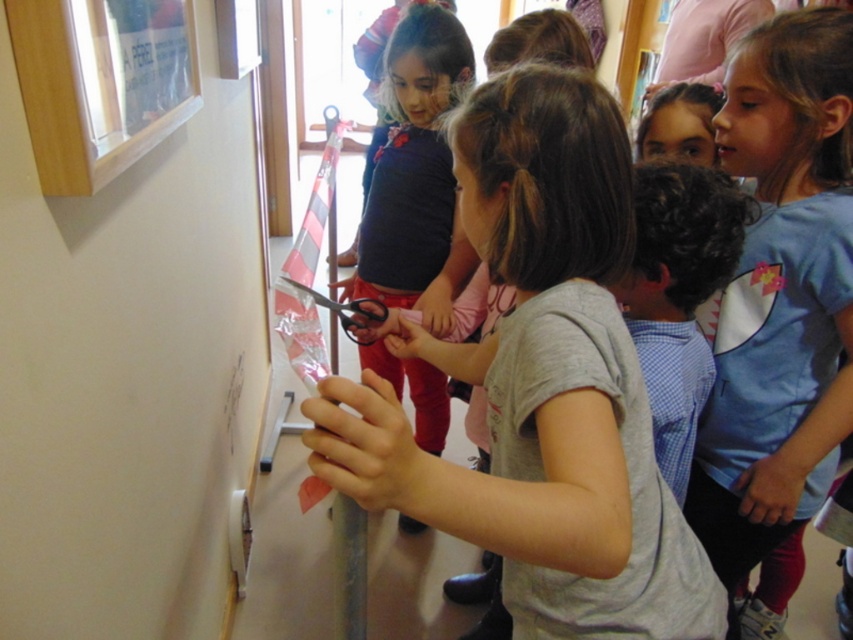
Question: Can you confirm if blue cotton shirt at center is positioned below matte black shirt at center?

Choices:
 (A) no
 (B) yes

Answer: (B)

Question: Which object is closer to the camera taking this photo?

Choices:
 (A) wooden frame at upper left
 (B) matte black shirt at center
 (C) blue cotton shirt at center

Answer: (A)

Question: Observing the image, what is the correct spatial positioning of blue cotton shirt at center in reference to wooden frame at upper left?

Choices:
 (A) right
 (B) left

Answer: (A)

Question: Does matte black shirt at center have a smaller size compared to wooden frame at upper left?

Choices:
 (A) no
 (B) yes

Answer: (A)

Question: Which object is closer to the camera taking this photo?

Choices:
 (A) matte black shirt at center
 (B) blue cotton shirt at center

Answer: (B)

Question: Among these points, which one is farthest from the camera?

Choices:
 (A) (131, 106)
 (B) (415, 74)
 (C) (822, 208)

Answer: (B)